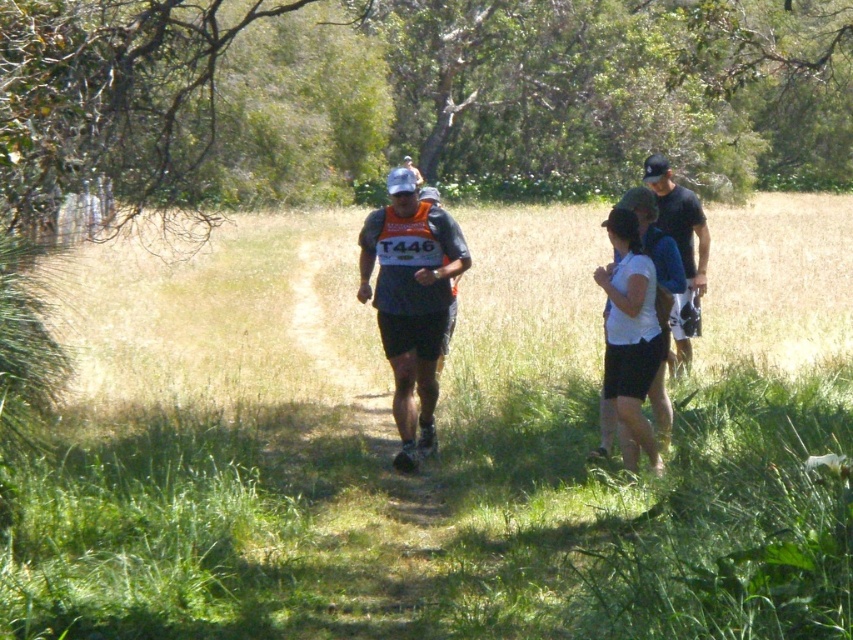
Who is shorter, green grass at center or black fabric shirt at right?

With less height is green grass at center.

Between green grass at center and black fabric shirt at right, which one is positioned higher?

Positioned higher is black fabric shirt at right.

Which is behind, point (352, 582) or point (683, 220)?

The point (683, 220) is behind.

At what (x,y) coordinates should I click in order to perform the action: click on green grass at center. Please return your answer as a coordinate pair (x, y). Looking at the image, I should click on (437, 433).

Does green grass at center appear on the left side of matte gray shirt at center?

Incorrect, green grass at center is not on the left side of matte gray shirt at center.

Between green grass at center and matte gray shirt at center, which one is positioned lower?

green grass at center is lower down.

Is point (778, 368) positioned in front of point (393, 355)?

No, it is behind (393, 355).

Locate an element on the screen. This screenshot has height=640, width=853. green grass at center is located at coordinates (437, 433).

Between white matte shirt at center and matte gray cap at center, which one has more height?

With more height is matte gray cap at center.

Does white matte shirt at center appear over matte gray cap at center?

No, white matte shirt at center is not above matte gray cap at center.

Is point (640, 380) closer to camera compared to point (413, 168)?

Yes, it is in front of point (413, 168).

Image resolution: width=853 pixels, height=640 pixels. I want to click on white matte shirt at center, so click(630, 337).